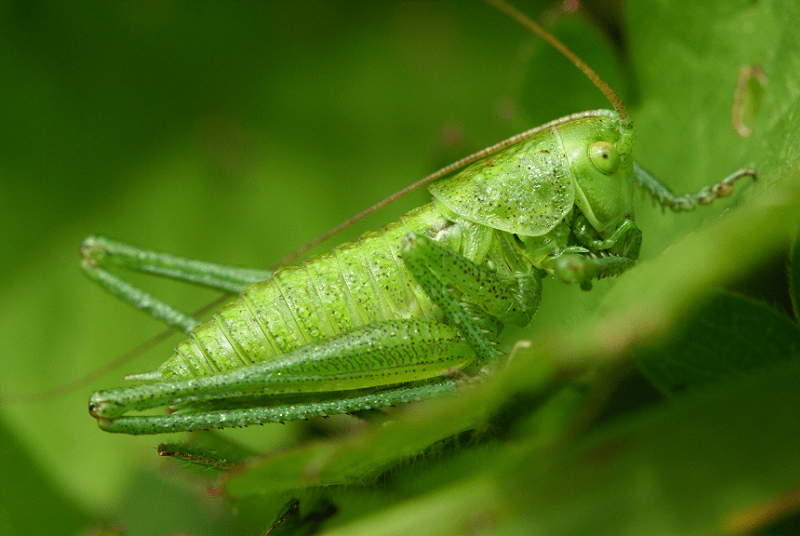
This screenshot has width=800, height=536. In order to click on bottom right leg in this screenshot , I will do `click(304, 379)`.